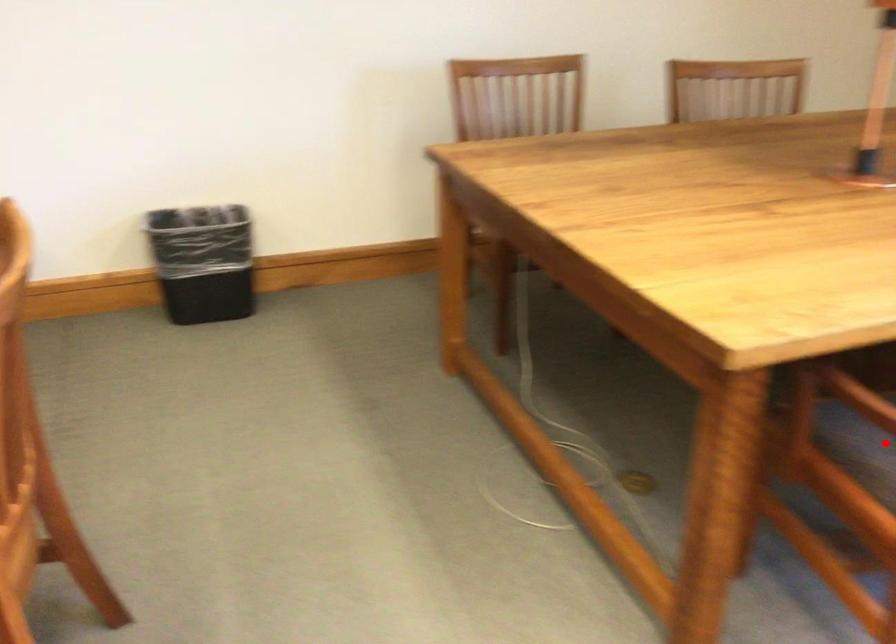
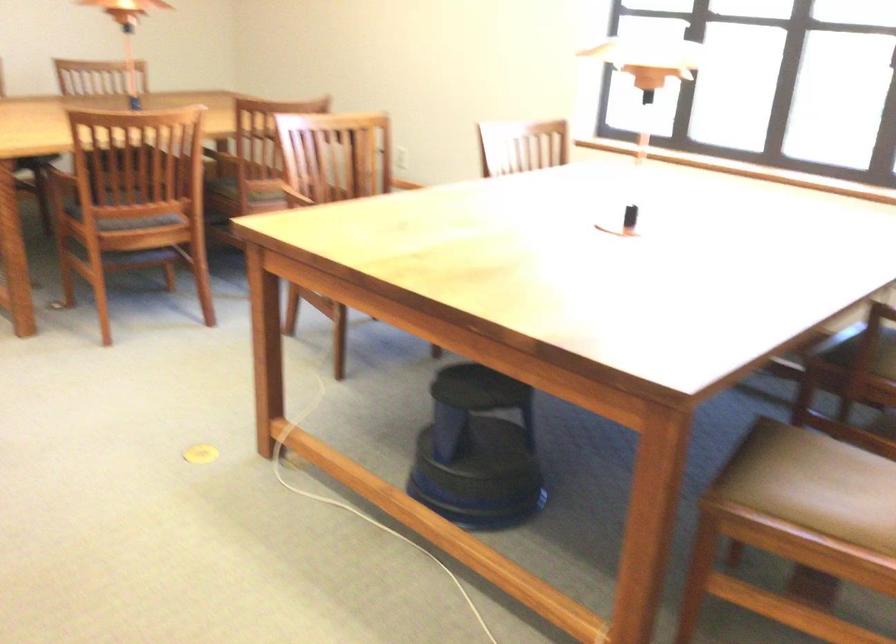
Question: I am providing you with two images of the same scene from different viewpoints. A red point is marked on the first image. Can you still see the location of the red point in image 2?

Choices:
 (A) Yes
 (B) No

Answer: (B)